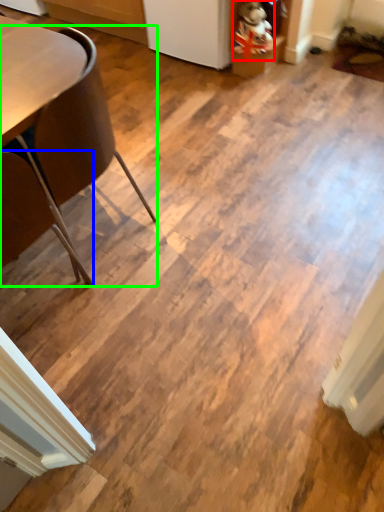
Question: Estimate the real-world distances between objects in this image. Which object is closer to toy (highlighted by a red box), chair (highlighted by a blue box) or chair (highlighted by a green box)?

Choices:
 (A) chair
 (B) chair

Answer: (B)